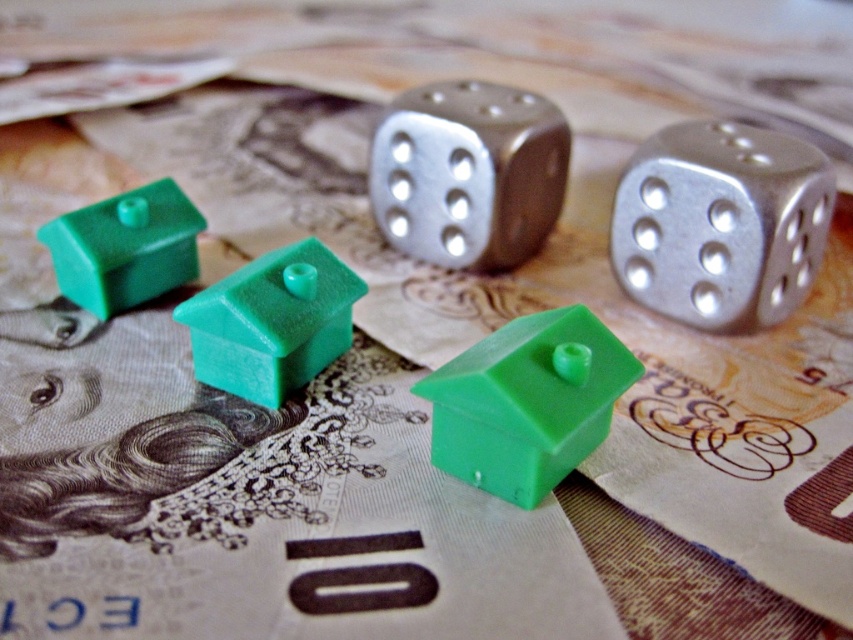
You are setting up a tabletop game and need to place both the metallic silver dice at center and the green plastic house at center on a shelf. If the shelf has a width limit of 10 cm, and the dice are 6 cm wide while the house is 4 cm wide, will both items fit side by side?

The metallic silver dice at center is 6 cm wide and the green plastic house at center is 4 cm wide. Combined, they total 10 cm, so they will just fit side by side on the shelf.

You are a game player who needs to place a 25.5 inch long ruler between the silver metallic dice at upper center and the green plastic house at upper left. Will the ruler fit between them without overlapping either object?

The distance between the silver metallic dice at upper center and the green plastic house at upper left is 30.41 inches. Since the ruler is 25.5 inches long, it will fit between them without overlapping either object because 25.5 is less than 30.41.